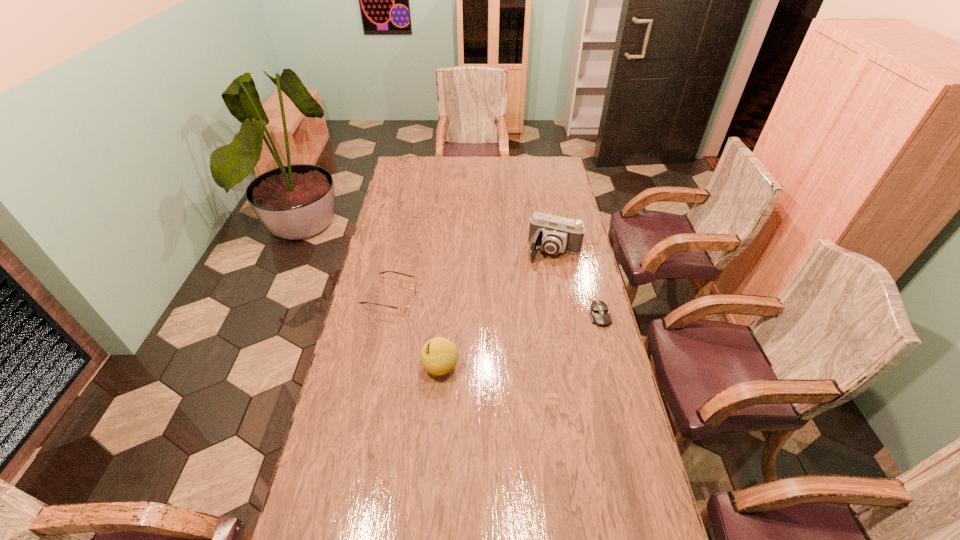
This screenshot has height=540, width=960. I want to click on vacant area located on the left of the computer mouse, so click(506, 315).

At what (x,y) coordinates should I click in order to perform the action: click on vacant space located at the front of the tallest object with an open lens cover. Please return your answer as a coordinate pair (x, y). The width and height of the screenshot is (960, 540). Looking at the image, I should click on (534, 300).

Locate an element on the screen. vacant space located 0.230m at the front of the tallest object with an open lens cover is located at coordinates (534, 301).

This screenshot has width=960, height=540. In order to click on free space located at the front of the tallest object with an open lens cover in this screenshot , I will do `click(521, 334)`.

The image size is (960, 540). I want to click on blank area located 0.070m on the front-facing side of the second shortest object, so pos(433,307).

Find the location of a particular element. The image size is (960, 540). free space located 0.100m on the front-facing side of the second shortest object is located at coordinates (441, 308).

Locate an element on the screen. vacant space located 0.130m on the front-facing side of the second shortest object is located at coordinates (448, 310).

At what (x,y) coordinates should I click in order to perform the action: click on object that is at the left edge. Please return your answer as a coordinate pair (x, y). The image size is (960, 540). Looking at the image, I should click on (403, 307).

The height and width of the screenshot is (540, 960). What are the coordinates of `computer mouse at the right edge` in the screenshot? It's located at (599, 314).

Image resolution: width=960 pixels, height=540 pixels. Identify the location of camera located in the right edge section of the desktop. (553, 234).